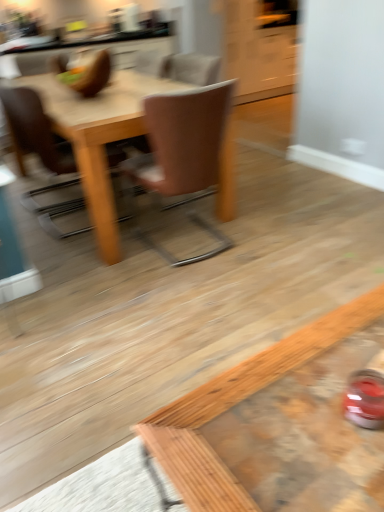
The image size is (384, 512). What do you see at coordinates (259, 48) in the screenshot? I see `white glossy cabinet at upper center` at bounding box center [259, 48].

The width and height of the screenshot is (384, 512). Identify the location of white glossy cabinet at upper center. (259, 48).

The width and height of the screenshot is (384, 512). I want to click on brown leather chair at center, which is the first chair from right to left, so coord(184,140).

From the picture: What is the approximate height of light brown wooden table at center?

It is 29.84 inches.

What is the approximate height of wooden coffee table at lower right?

The height of wooden coffee table at lower right is 16.69 inches.

What is the approximate height of brown leather chair at upper left, acting as the second chair starting from the right?

It is 35.14 inches.

Locate an element on the screen. Image resolution: width=384 pixels, height=512 pixels. white glossy cabinet at upper center is located at coordinates (259, 48).

Can we say brown leather chair at upper left, the first chair in the left-to-right sequence, lies outside white glossy cabinet at upper center?

Yes, brown leather chair at upper left, the first chair in the left-to-right sequence, is located beyond the bounds of white glossy cabinet at upper center.

Is brown leather chair at upper left, the first chair in the left-to-right sequence, wider than white glossy cabinet at upper center?

No, brown leather chair at upper left, the first chair in the left-to-right sequence, is not wider than white glossy cabinet at upper center.

Are brown leather chair at upper left, the first chair in the left-to-right sequence, and white glossy cabinet at upper center located far from each other?

brown leather chair at upper left, the first chair in the left-to-right sequence, is positioned a significant distance from white glossy cabinet at upper center.

Considering the positions of objects brown leather chair at upper left, acting as the second chair starting from the right, and brown leather chair at center, which is the first chair from right to left, in the image provided, who is in front, brown leather chair at upper left, acting as the second chair starting from the right, or brown leather chair at center, which is the first chair from right to left,?

brown leather chair at center, which is the first chair from right to left.

Is brown leather chair at upper left, the first chair in the left-to-right sequence, in contact with brown leather chair at center, which is the 2th chair from left to right?

No, brown leather chair at upper left, the first chair in the left-to-right sequence, is not in contact with brown leather chair at center, which is the 2th chair from left to right.

Is brown leather chair at upper left, the first chair in the left-to-right sequence, positioned with its back to brown leather chair at center, which is the first chair from right to left?

That's not correct — brown leather chair at upper left, the first chair in the left-to-right sequence, is not looking away from brown leather chair at center, which is the first chair from right to left.

In the scene shown: Which object is positioned more to the right, brown leather chair at upper left, acting as the second chair starting from the right, or brown leather chair at center, which is the 2th chair from left to right?

brown leather chair at center, which is the 2th chair from left to right, is more to the right.

Consider the image. Is brown leather chair at upper left, acting as the second chair starting from the right, further to camera compared to light brown wooden table at center?

Yes, it is.

Consider the image. Can light brown wooden table at center be found inside brown leather chair at upper left, the first chair in the left-to-right sequence?

No.

Which object is further away from the camera taking this photo, brown leather chair at center, which is the first chair from right to left, or wooden coffee table at lower right?

brown leather chair at center, which is the first chair from right to left.

Find the location of a particular element. The width and height of the screenshot is (384, 512). coffee table that is below the brown leather chair at center, which is the 2th chair from left to right (from the image's perspective) is located at coordinates (236, 403).

In the image, is brown leather chair at center, which is the first chair from right to left, on the left side or the right side of wooden coffee table at lower right?

In the image, brown leather chair at center, which is the first chair from right to left, appears on the left side of wooden coffee table at lower right.

Between brown leather chair at center, which is the first chair from right to left, and wooden coffee table at lower right, which one has larger size?

brown leather chair at center, which is the first chair from right to left.

From the image's perspective, is white glossy cabinet at upper center above or below brown leather chair at center, which is the first chair from right to left?

white glossy cabinet at upper center is situated higher than brown leather chair at center, which is the first chair from right to left, in the image.

From a real-world perspective, which is physically below, white glossy cabinet at upper center or brown leather chair at center, which is the first chair from right to left?

In real-world perspective, white glossy cabinet at upper center is lower.

Are white glossy cabinet at upper center and brown leather chair at center, which is the first chair from right to left, located far from each other?

white glossy cabinet at upper center is positioned a significant distance from brown leather chair at center, which is the first chair from right to left.

Choose the correct answer: Is white glossy cabinet at upper center inside brown leather chair at center, which is the 2th chair from left to right, or outside it?

white glossy cabinet at upper center exists outside the volume of brown leather chair at center, which is the 2th chair from left to right.

Is wooden coffee table at lower right touching brown leather chair at center, which is the 2th chair from left to right?

There is a gap between wooden coffee table at lower right and brown leather chair at center, which is the 2th chair from left to right.

From a real-world perspective, is wooden coffee table at lower right under brown leather chair at center, which is the 2th chair from left to right?

Correct, in the physical world, wooden coffee table at lower right is lower than brown leather chair at center, which is the 2th chair from left to right.

In the scene shown: Is wooden coffee table at lower right to the left or to the right of brown leather chair at center, which is the 2th chair from left to right, in the image?

From the image, it's evident that wooden coffee table at lower right is to the right of brown leather chair at center, which is the 2th chair from left to right.

Based on the photo, does brown leather chair at upper left, the first chair in the left-to-right sequence, have a lesser width compared to wooden coffee table at lower right?

No.

How distant is brown leather chair at upper left, the first chair in the left-to-right sequence, from wooden coffee table at lower right?

brown leather chair at upper left, the first chair in the left-to-right sequence, and wooden coffee table at lower right are 1.92 meters apart from each other.

Looking at this image, is brown leather chair at upper left, the first chair in the left-to-right sequence, taller or shorter than wooden coffee table at lower right?

brown leather chair at upper left, the first chair in the left-to-right sequence, is taller than wooden coffee table at lower right.

Are brown leather chair at upper left, the first chair in the left-to-right sequence, and wooden coffee table at lower right making contact?

No.

From the white glossy cabinet at upper center, count 1st chairs forward and point to it. Please provide its 2D coordinates.

[(34, 129)]

Find the location of a particular element. This screenshot has width=384, height=512. chair below the brown leather chair at upper left, acting as the second chair starting from the right (from the image's perspective) is located at coordinates (184, 140).

Based on their spatial positions, is wooden coffee table at lower right or brown leather chair at upper left, acting as the second chair starting from the right, further from white glossy cabinet at upper center?

wooden coffee table at lower right lies further to white glossy cabinet at upper center than the other object.

Based on their spatial positions, is brown leather chair at center, which is the 2th chair from left to right, or brown leather chair at upper left, the first chair in the left-to-right sequence, closer to wooden coffee table at lower right?

brown leather chair at center, which is the 2th chair from left to right.

In the scene shown: Considering their positions, is light brown wooden table at center positioned further to brown leather chair at center, which is the 2th chair from left to right, than wooden coffee table at lower right?

The object further to brown leather chair at center, which is the 2th chair from left to right, is wooden coffee table at lower right.

Estimate the real-world distances between objects in this image. Which object is further from brown leather chair at upper left, acting as the second chair starting from the right, wooden coffee table at lower right or white glossy cabinet at upper center?

Among the two, white glossy cabinet at upper center is located further to brown leather chair at upper left, acting as the second chair starting from the right.

Looking at the image, which one is located further to wooden coffee table at lower right, white glossy cabinet at upper center or light brown wooden table at center?

white glossy cabinet at upper center is further to wooden coffee table at lower right.

From the image, which object appears to be farther from wooden coffee table at lower right, brown leather chair at upper left, acting as the second chair starting from the right, or brown leather chair at center, which is the first chair from right to left?

brown leather chair at upper left, acting as the second chair starting from the right.

Considering their positions, is brown leather chair at center, which is the first chair from right to left, positioned further to wooden coffee table at lower right than light brown wooden table at center?

light brown wooden table at center lies further to wooden coffee table at lower right than the other object.

From the image, which object appears to be nearer to brown leather chair at center, which is the 2th chair from left to right, brown leather chair at upper left, the first chair in the left-to-right sequence, or white glossy cabinet at upper center?

brown leather chair at upper left, the first chair in the left-to-right sequence, is closer to brown leather chair at center, which is the 2th chair from left to right.

This screenshot has height=512, width=384. In order to click on chair between wooden coffee table at lower right and light brown wooden table at center along the z-axis in this screenshot , I will do `click(184, 140)`.

You are a GUI agent. You are given a task and a screenshot of the screen. Output one action in this format:
    pyautogui.click(x=<x>, y=<y>)
    Task: Click on the kitchen & dining room table between brown leather chair at upper left, the first chair in the left-to-right sequence, and brown leather chair at center, which is the 2th chair from left to right, in the horizontal direction
    This screenshot has width=384, height=512.
    Given the screenshot: What is the action you would take?
    pyautogui.click(x=99, y=135)

You are a GUI agent. You are given a task and a screenshot of the screen. Output one action in this format:
    pyautogui.click(x=<x>, y=<y>)
    Task: Click on the kitchen & dining room table located between wooden coffee table at lower right and brown leather chair at upper left, the first chair in the left-to-right sequence, in the depth direction
    The width and height of the screenshot is (384, 512).
    Given the screenshot: What is the action you would take?
    pyautogui.click(x=99, y=135)

This screenshot has height=512, width=384. What are the coordinates of `kitchen & dining room table positioned between wooden coffee table at lower right and white glossy cabinet at upper center from near to far` in the screenshot? It's located at (99, 135).